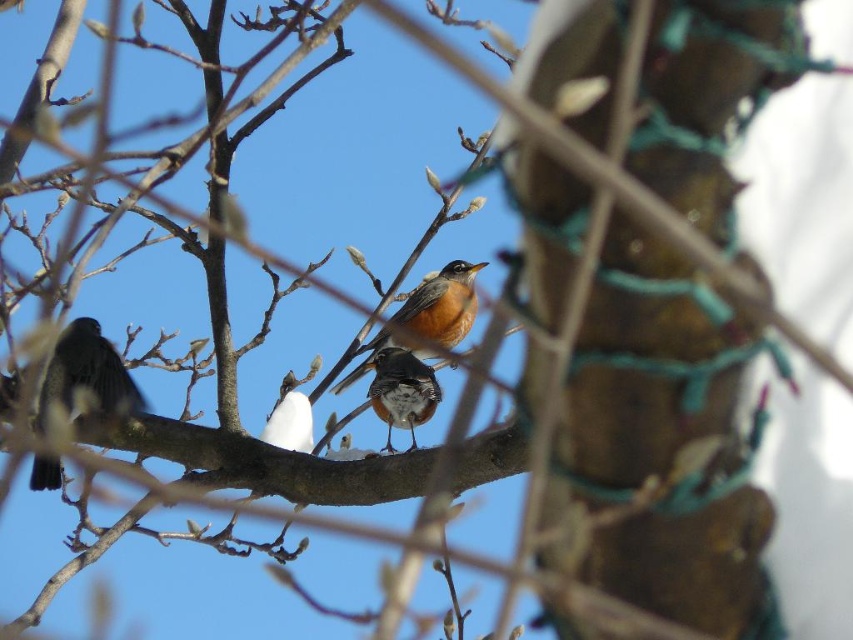
You are a birdwatcher trying to locate a specific bird in the scene. The coordinates given are point (427, 316). Based on the coordinates, which bird is this point located on?

The point (427, 316) is located on the bright orange bird at center.

You are an ornithologist observing two birds in a tree branch. You notice a brown speckled feathers at center and a white fluffy bird at center. Which bird is positioned higher on the branch?

The brown speckled feathers at center is above the white fluffy bird at center, so it is positioned higher on the branch.